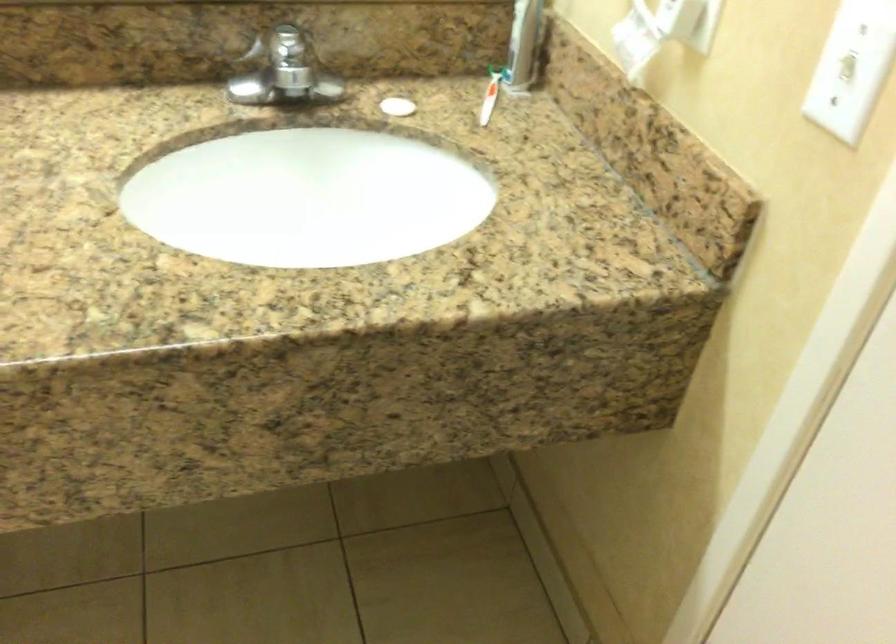
Find where to turn the faucet handle. Please return your answer as a coordinate pair (x, y).

(285, 69)